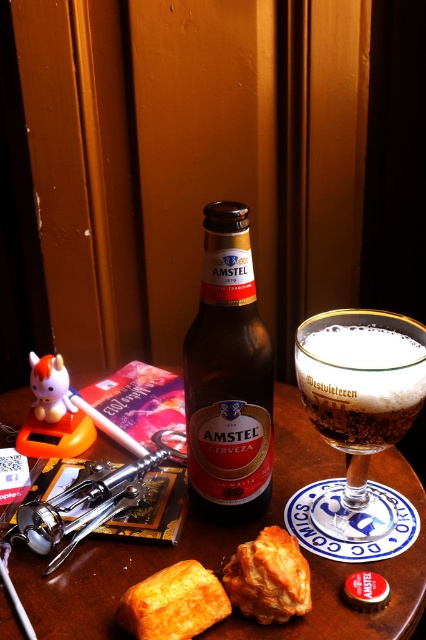
Question: Is foamy amber liquid at center to the right of golden fried pastry at center from the viewer's perspective?

Choices:
 (A) yes
 (B) no

Answer: (A)

Question: Is satin silver metal corkscrew at lower left below golden crispy pastry at center?

Choices:
 (A) no
 (B) yes

Answer: (A)

Question: Among these objects, which one is nearest to the camera?

Choices:
 (A) foamy amber liquid at center
 (B) amber glass bottle at center

Answer: (A)

Question: Can you confirm if wooden table at center is smaller than foamy amber liquid at center?

Choices:
 (A) yes
 (B) no

Answer: (B)

Question: Which point is closer to the camera?

Choices:
 (A) golden fried pastry at center
 (B) amber glass bottle at center
 (C) foamy amber liquid at center
 (D) satin silver metal corkscrew at lower left

Answer: (A)

Question: Which object is positioned farthest from the golden fried pastry at center?

Choices:
 (A) satin silver metal corkscrew at lower left
 (B) amber glass bottle at center
 (C) foamy amber liquid at center

Answer: (C)